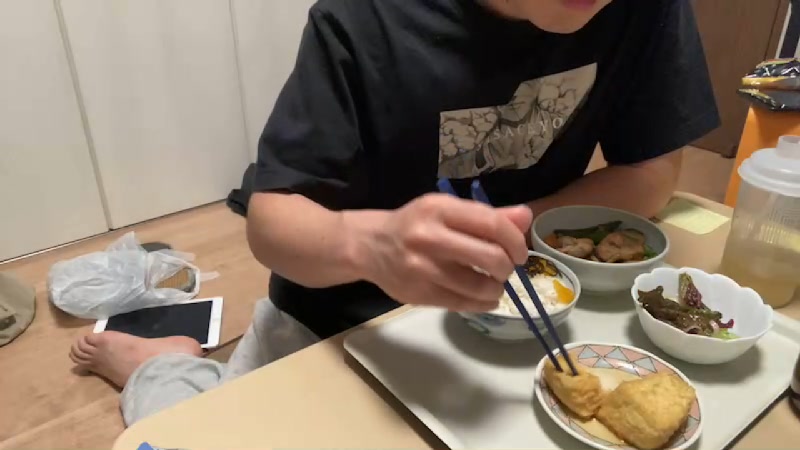
Identify the location of door. The width and height of the screenshot is (800, 450). (744, 56).